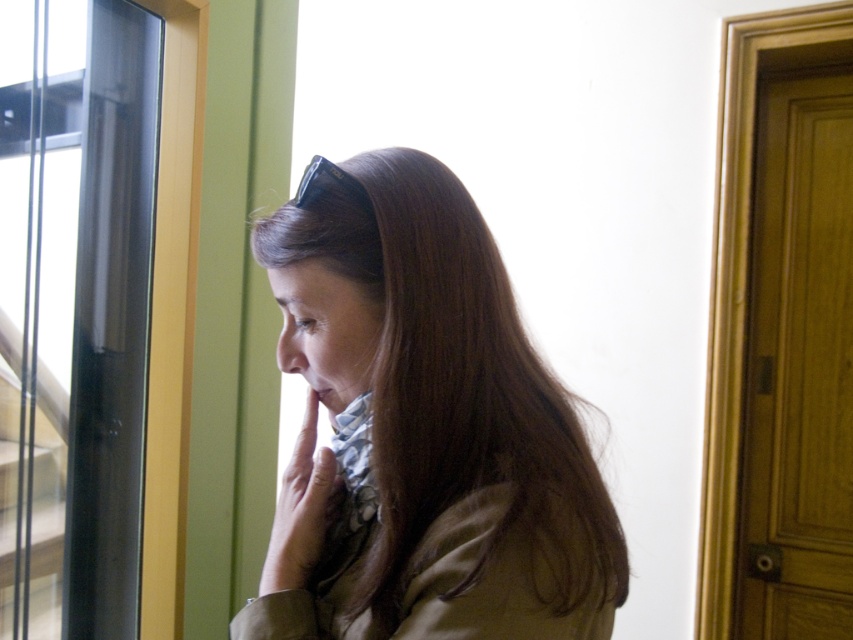
Please provide the coordinates of the brown matte hair at center in the image. The coordinates should be in the format of a point with two decimal places, like this example format point 0.5,0.5.

The coordinates of the brown matte hair at center are point (422, 429).

You are an interior designer observing the scene. You need to determine the spatial relationship between the brown matte hair at center and the transparent glass door at left. Which object is located higher in the image?

The brown matte hair at center is positioned under the transparent glass door at left, so the transparent glass door at left is higher in the image.

Based on the photo, you are a photographer trying to capture a closeup of the woman in the scene. You need to ensure that both the brown matte hair at center and the matte skin at center are in focus. Given that your camera can only maintain focus on objects within a 4 inch range, will both objects be in focus?

The brown matte hair at center is 4.85 inches away from matte skin at center. Since the distance between them exceeds the camera focus range of 4 inches, the two objects cannot both be in focus at the same time.